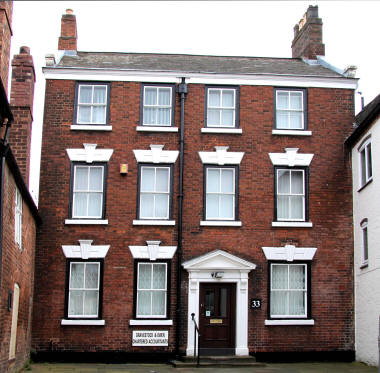
The width and height of the screenshot is (380, 373). Identify the location of chimney. (17, 85), (70, 35), (314, 31).